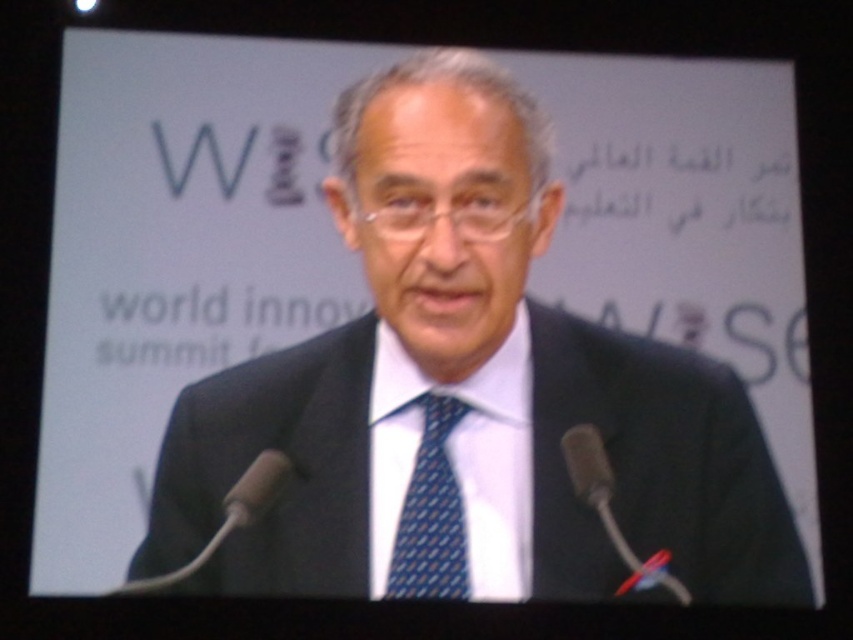
Which is in front, point (437, 564) or point (276, 476)?

Point (437, 564) is in front.

Is blue dotted tie at center to the right of black plastic microphone at lower left from the viewer's perspective?

Yes, blue dotted tie at center is to the right of black plastic microphone at lower left.

You are a GUI agent. You are given a task and a screenshot of the screen. Output one action in this format:
    pyautogui.click(x=<x>, y=<y>)
    Task: Click on the blue dotted tie at center
    Image resolution: width=853 pixels, height=640 pixels.
    Given the screenshot: What is the action you would take?
    pyautogui.click(x=431, y=515)

Does metallic silver microphone at center have a smaller size compared to black plastic microphone at lower left?

Actually, metallic silver microphone at center might be larger than black plastic microphone at lower left.

Looking at this image, is metallic silver microphone at center wider than black plastic microphone at lower left?

In fact, metallic silver microphone at center might be narrower than black plastic microphone at lower left.

Who is more forward, (605, 499) or (287, 474)?

Point (605, 499) is in front.

You are a GUI agent. You are given a task and a screenshot of the screen. Output one action in this format:
    pyautogui.click(x=<x>, y=<y>)
    Task: Click on the metallic silver microphone at center
    Image resolution: width=853 pixels, height=640 pixels.
    Given the screenshot: What is the action you would take?
    pyautogui.click(x=610, y=509)

Between black silk suit at center and metallic silver microphone at center, which one appears on the right side from the viewer's perspective?

metallic silver microphone at center

Is black silk suit at center bigger than metallic silver microphone at center?

Yes.

Who is more distant from viewer, (187,476) or (601,456)?

The point (187,476) is behind.

This screenshot has width=853, height=640. Find the location of `black silk suit at center`. black silk suit at center is located at coordinates tap(466, 396).